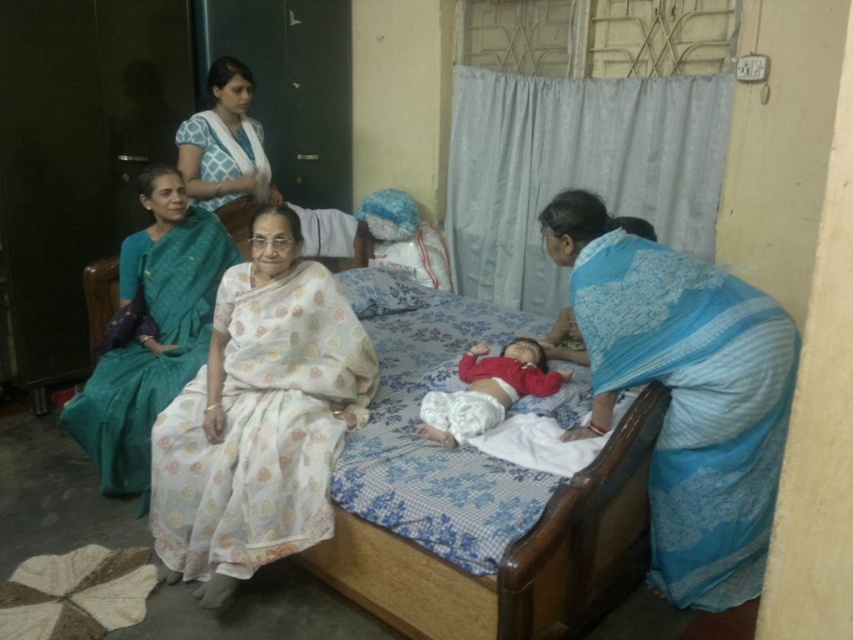
Is the position of blue floral saree at right more distant than that of red cotton baby at center?

No, blue floral saree at right is closer to the viewer.

Who is shorter, blue floral saree at right or red cotton baby at center?

With less height is red cotton baby at center.

Who is more forward, (579,321) or (474,374)?

Point (579,321) is more forward.

Find the location of a particular element. blue floral saree at right is located at coordinates (683, 394).

Is point (746, 465) positioned before point (154, 198)?

Yes, point (746, 465) is in front of point (154, 198).

Does blue floral saree at right have a greater width compared to teal silk saree at left?

Indeed, blue floral saree at right has a greater width compared to teal silk saree at left.

Is point (758, 392) farther from viewer compared to point (115, 410)?

That is False.

Locate an element on the screen. This screenshot has width=853, height=640. blue floral saree at right is located at coordinates (683, 394).

Who is higher up, teal silk saree at left or white printed saree at upper center?

white printed saree at upper center is higher up.

From the picture: Is teal silk saree at left closer to the viewer compared to white printed saree at upper center?

That is True.

Between point (189, 269) and point (234, 93), which one is positioned behind?

The point (234, 93) is more distant.

You are a GUI agent. You are given a task and a screenshot of the screen. Output one action in this format:
    pyautogui.click(x=<x>, y=<y>)
    Task: Click on the teal silk saree at left
    
    Given the screenshot: What is the action you would take?
    pyautogui.click(x=149, y=332)